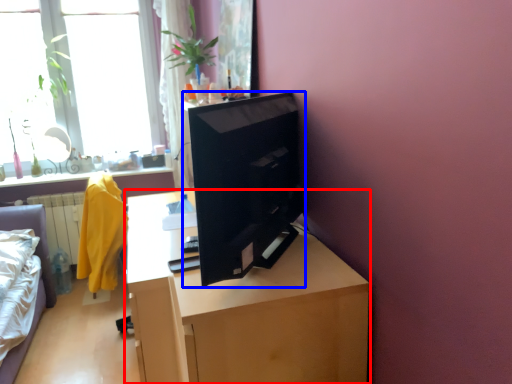
Question: Among these objects, which one is farthest to the camera, desk (highlighted by a red box) or computer (highlighted by a blue box)?

Choices:
 (A) desk
 (B) computer

Answer: (A)